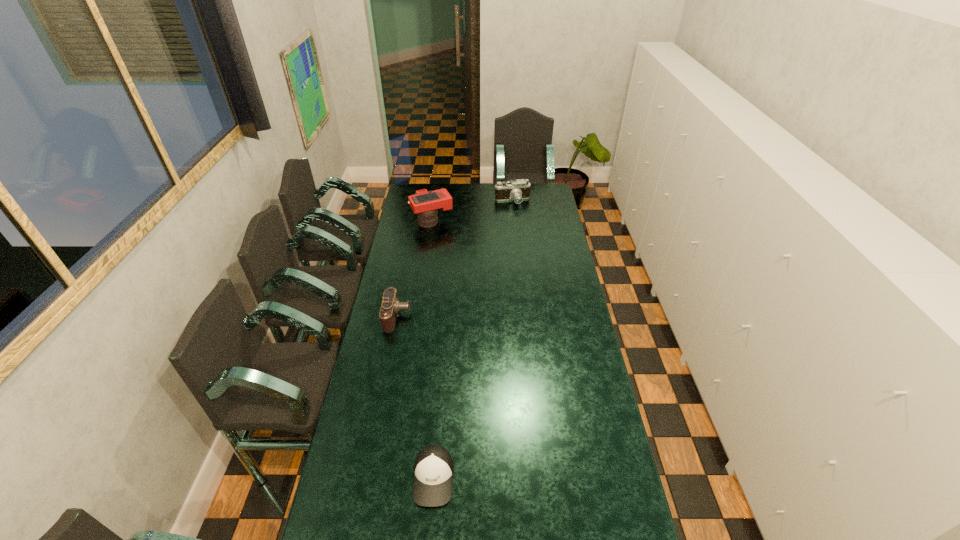
Identify the location of vacant space situated on the front panel of the cap. This screenshot has height=540, width=960. (429, 534).

In order to click on object located at the far edge in this screenshot , I will do `click(517, 190)`.

The image size is (960, 540). In order to click on object present at the right edge in this screenshot , I will do `click(517, 190)`.

Find the location of a particular element. The image size is (960, 540). object present at the far right corner is located at coordinates (517, 190).

The width and height of the screenshot is (960, 540). I want to click on vacant region at the far edge of the desktop, so click(453, 185).

The width and height of the screenshot is (960, 540). Find the location of `vacant region at the left edge of the desktop`. vacant region at the left edge of the desktop is located at coordinates (354, 492).

At what (x,y) coordinates should I click in order to perform the action: click on free space at the right edge of the desktop. Please return your answer as a coordinate pair (x, y). This screenshot has width=960, height=540. Looking at the image, I should click on (544, 211).

I want to click on vacant position at the far right corner of the desktop, so click(547, 187).

I want to click on vacant area between the shortest camera and the rightmost camera, so click(x=455, y=259).

This screenshot has width=960, height=540. In order to click on vacant area that lies between the tallest object and the shortest camera in this screenshot , I will do `click(415, 269)`.